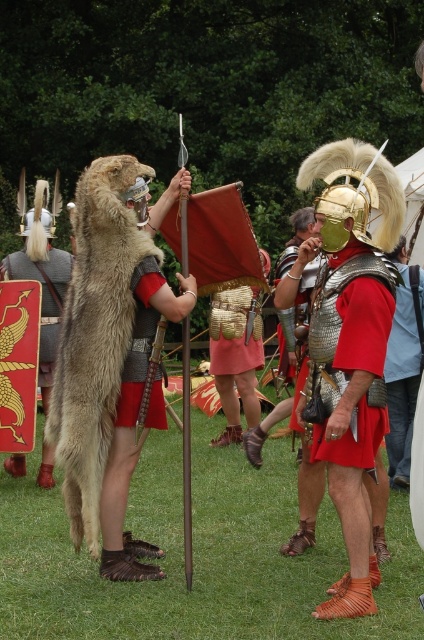
Which is behind, point (348, 340) or point (395, 452)?

The point (395, 452) is more distant.

The width and height of the screenshot is (424, 640). What are the coordinates of `metallic chainmail armor at center` in the screenshot? It's located at (362, 324).

Is point (379, 346) farther from viewer compared to point (412, 312)?

No.

I want to click on metallic chainmail armor at center, so click(x=362, y=324).

Consider the image. Can you confirm if red fabric skirt at center is smaller than gold plated shield at center?

Indeed, red fabric skirt at center has a smaller size compared to gold plated shield at center.

Between red fabric skirt at center and gold plated shield at center, which one has more height?

Standing taller between the two is red fabric skirt at center.

The width and height of the screenshot is (424, 640). What are the coordinates of `red fabric skirt at center` in the screenshot? It's located at tap(402, 368).

The height and width of the screenshot is (640, 424). Find the location of `red fabric skirt at center`. red fabric skirt at center is located at coordinates (x=402, y=368).

Does furry brown animal at center come behind gold plated shield at center?

No, furry brown animal at center is in front of gold plated shield at center.

Who is positioned more to the right, furry brown animal at center or gold plated shield at center?

furry brown animal at center is more to the right.

Does point (75, 220) come in front of point (53, 301)?

That is True.

Where is `furry brown animal at center`? furry brown animal at center is located at coordinates (94, 336).